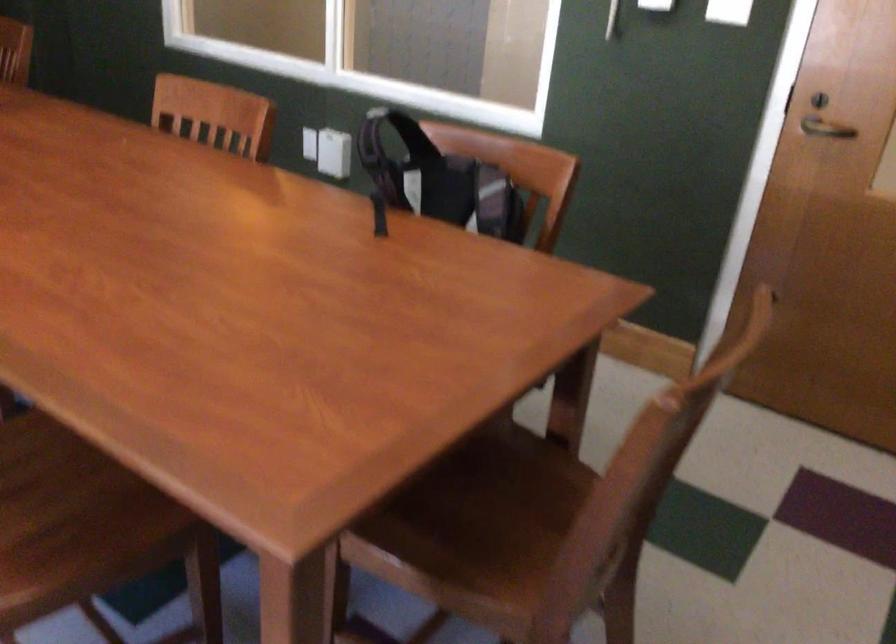
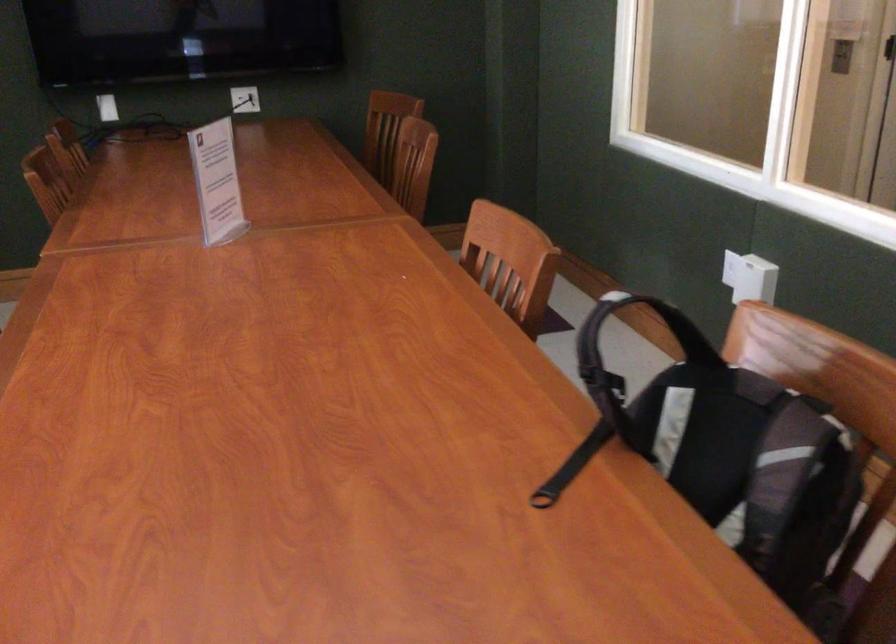
Question: I am providing you with two images of the same scene from different viewpoints. After the viewpoint changes to image2, which objects are now occluded?

Choices:
 (A) white power outlet
 (B) backpack strap
 (C) backpack handle
 (D) none of these

Answer: (D)